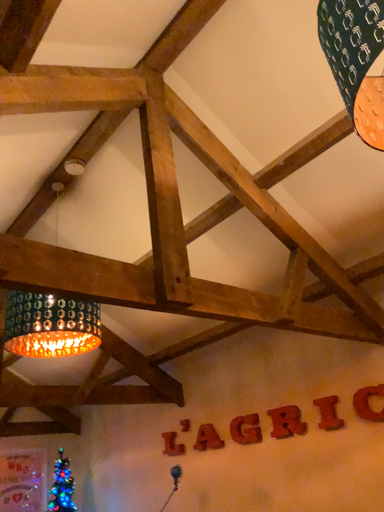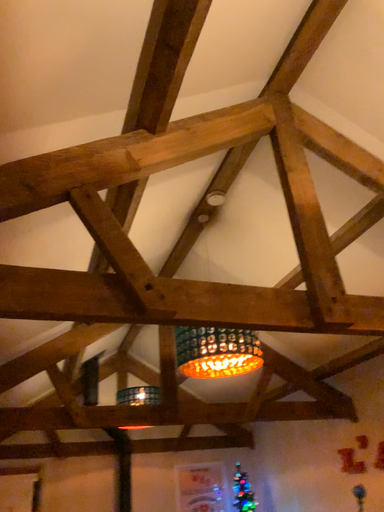
Question: Which way did the camera rotate in the video?

Choices:
 (A) rotated left
 (B) rotated right

Answer: (A)